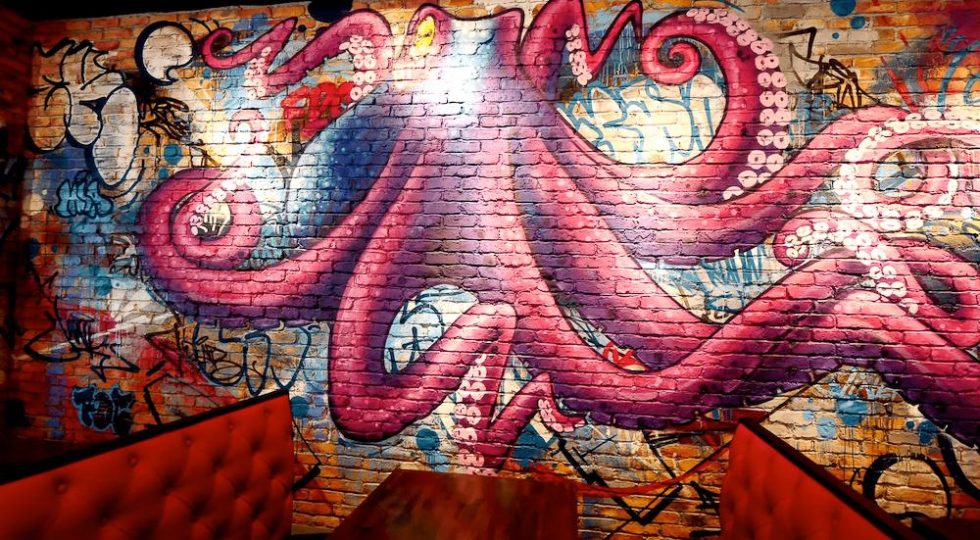
Where is `cushion`? cushion is located at coordinates (203, 463), (152, 474), (83, 492), (247, 443), (276, 432).